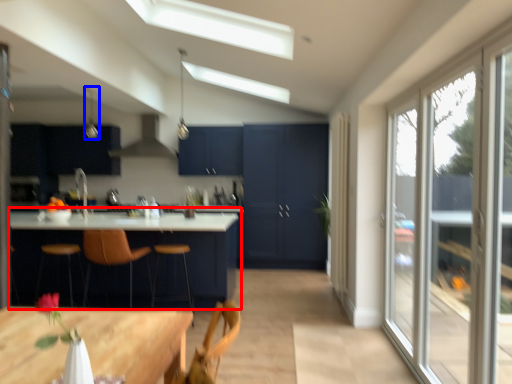
Question: Which object is closer to the camera taking this photo, table (highlighted by a red box) or light fixture (highlighted by a blue box)?

Choices:
 (A) table
 (B) light fixture

Answer: (A)